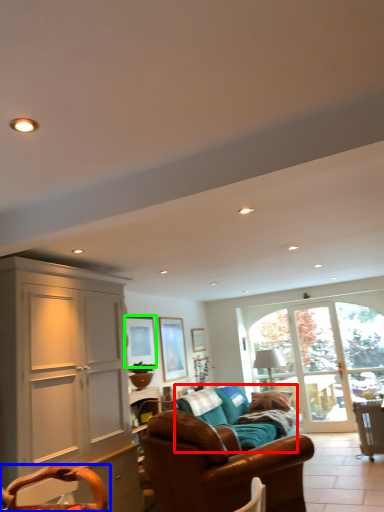
Question: Which object is positioned farthest from studio couch (highlighted by a red box)? Select from swivel chair (highlighted by a blue box) and picture frame (highlighted by a green box).

Choices:
 (A) swivel chair
 (B) picture frame

Answer: (A)